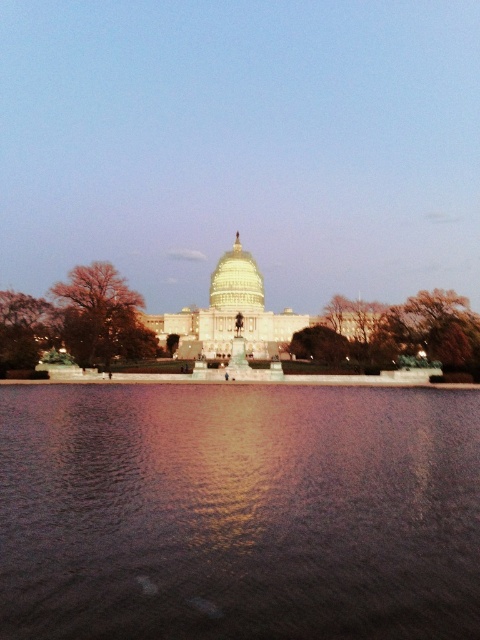
You are standing in front of the United States Capitol building and see a brown leafy tree at center and a green leafy tree at left. Which tree is positioned to the right of the other?

The brown leafy tree at center is positioned to the right of the green leafy tree at left.

You are standing in front of the United States Capitol building and notice two trees. One is the brown leafy tree at center and the other is the green leafy tree at left. Which tree has a larger width?

The brown leafy tree at center might be wider than green leafy tree at left.

You are standing at the point labeled as point (x=396, y=332) in the image. What object are you directly facing?

You are directly facing the brown leafy tree at center.